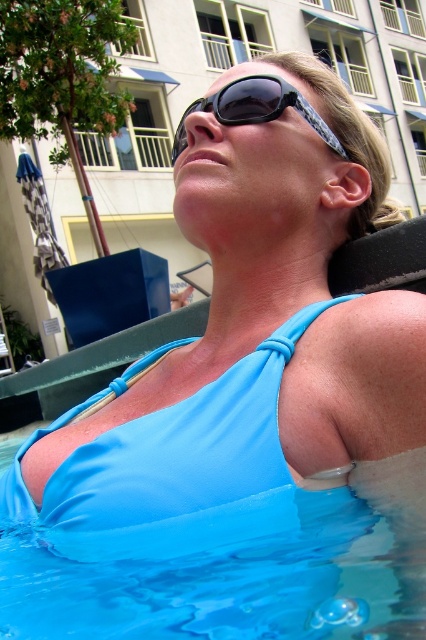
Question: Is transparent blue water at lower center thinner than black textured sunglasses at center?

Choices:
 (A) no
 (B) yes

Answer: (A)

Question: Is transparent blue water at lower center bigger than matte blue bikini top at upper center?

Choices:
 (A) no
 (B) yes

Answer: (A)

Question: Which point is closer to the camera taking this photo?

Choices:
 (A) (417, 547)
 (B) (169, 464)

Answer: (A)

Question: Which point appears farthest from the camera in this image?

Choices:
 (A) (264, 120)
 (B) (417, 497)
 (C) (222, 486)

Answer: (A)

Question: Estimate the real-world distances between objects in this image. Which object is closer to the matte blue bikini top at upper center?

Choices:
 (A) transparent blue water at lower center
 (B) black textured sunglasses at center

Answer: (A)

Question: Can you confirm if matte blue bikini top at upper center is positioned above black textured sunglasses at center?

Choices:
 (A) yes
 (B) no

Answer: (B)